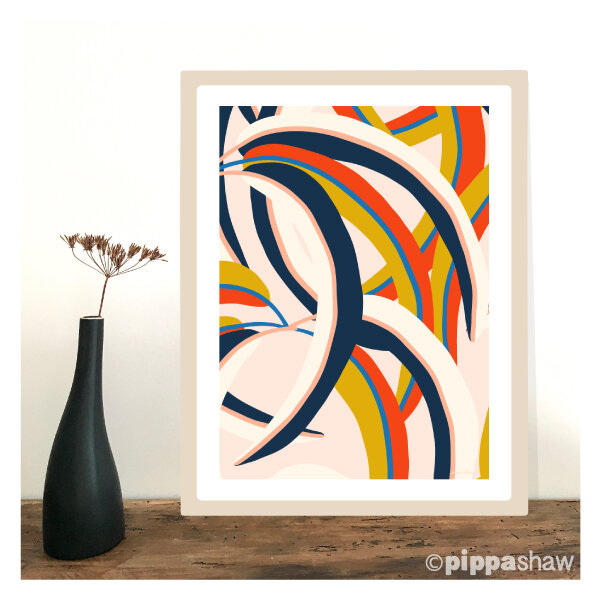
The height and width of the screenshot is (600, 600). Find the location of `wall`. wall is located at coordinates (100, 146).